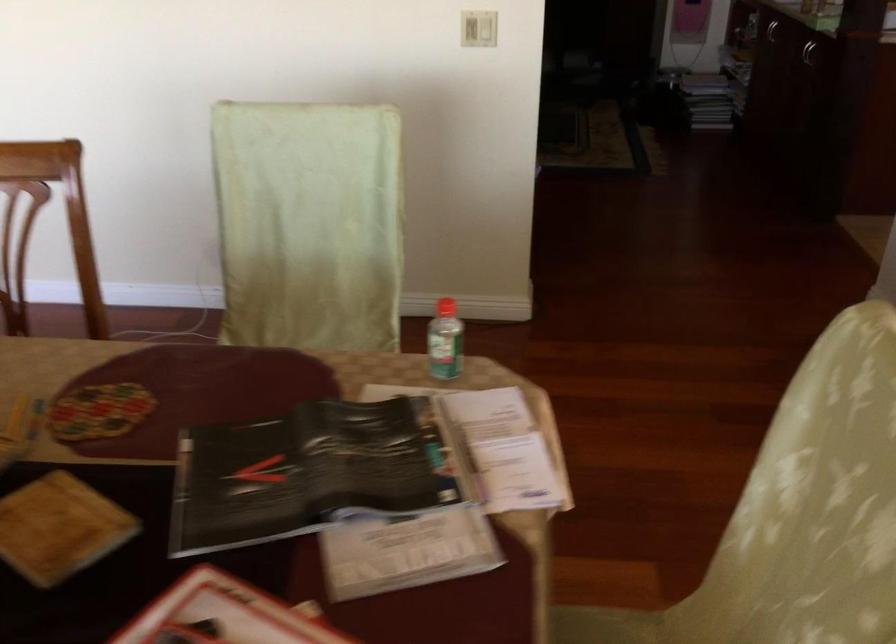
What do you see at coordinates (606, 626) in the screenshot? I see `a chair sitting surface` at bounding box center [606, 626].